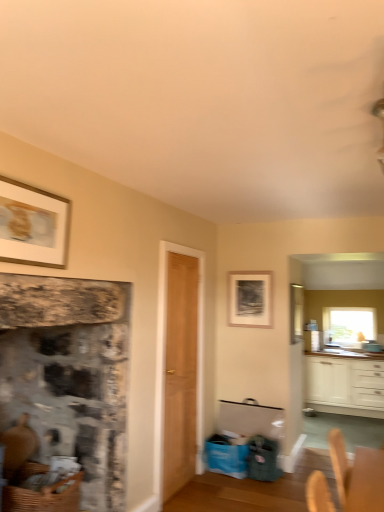
Find the location of a particular element. This screenshot has width=384, height=512. gold-framed picture at upper left, which ranks as the first picture frame in front-to-back order is located at coordinates (33, 225).

Image resolution: width=384 pixels, height=512 pixels. What are the coordinates of `rustic stone fireplace at left` in the screenshot? It's located at (69, 374).

What do you see at coordinates (43, 497) in the screenshot? This screenshot has height=512, width=384. I see `woven brown basket at lower left` at bounding box center [43, 497].

Locate an element on the screen. The image size is (384, 512). matte black picture frame at center, arranged as the first picture frame when ordered from the bottom is located at coordinates (250, 298).

The width and height of the screenshot is (384, 512). What do you see at coordinates (349, 325) in the screenshot?
I see `clear glass window at upper right` at bounding box center [349, 325].

The width and height of the screenshot is (384, 512). What are the coordinates of `clear glass window at upper right` in the screenshot? It's located at (349, 325).

What do you see at coordinates (344, 385) in the screenshot?
I see `white glossy cabinets at lower right` at bounding box center [344, 385].

You are a GUI agent. You are given a task and a screenshot of the screen. Output one action in this format:
    pyautogui.click(x=<x>, y=<y>)
    Task: Click on the gold-framed picture at upper left, which ranks as the second picture frame in bottom-to-top order
    
    Given the screenshot: What is the action you would take?
    pyautogui.click(x=33, y=225)

From the image's perspective, is matte black picture frame at center, arranged as the first picture frame when ordered from the bottom, beneath clear glass window screen at upper right?

Actually, matte black picture frame at center, arranged as the first picture frame when ordered from the bottom, appears above clear glass window screen at upper right in the image.

Is matte black picture frame at center, which is counted as the first picture frame, starting from the right, far away from clear glass window screen at upper right?

That's right, there is a large distance between matte black picture frame at center, which is counted as the first picture frame, starting from the right, and clear glass window screen at upper right.

Is matte black picture frame at center, arranged as the first picture frame when ordered from the bottom, closer to the viewer compared to clear glass window screen at upper right?

No, matte black picture frame at center, arranged as the first picture frame when ordered from the bottom, is further to the viewer.

Which is in front, point (295, 312) or point (53, 485)?

The point (53, 485) is closer to the camera.

Based on the photo, from a real-world perspective, is clear glass window screen at upper right positioned under woven brown basket at lower left based on gravity?

No, from a real-world perspective, clear glass window screen at upper right is not below woven brown basket at lower left.

Considering the positions of objects clear glass window screen at upper right and woven brown basket at lower left in the image provided, who is more to the left, clear glass window screen at upper right or woven brown basket at lower left?

woven brown basket at lower left is more to the left.

Considering the sizes of objects clear glass window screen at upper right and woven brown basket at lower left in the image provided, who is shorter, clear glass window screen at upper right or woven brown basket at lower left?

woven brown basket at lower left.

Would you say white glossy cabinets at lower right is inside or outside light brown wood door at center?

white glossy cabinets at lower right cannot be found inside light brown wood door at center.

Can you confirm if white glossy cabinets at lower right is shorter than light brown wood door at center?

Correct, white glossy cabinets at lower right is not as tall as light brown wood door at center.

Between white glossy cabinets at lower right and light brown wood door at center, which one has smaller width?

With smaller width is light brown wood door at center.

Is point (375, 410) closer or farther from the camera than point (183, 269)?

Point (375, 410).

Considering the relative positions of light brown wood door at center and clear glass window at upper right in the image provided, is light brown wood door at center to the right of clear glass window at upper right from the viewer's perspective?

No.

From the image's perspective, relative to clear glass window at upper right, is light brown wood door at center above or below?

light brown wood door at center is situated higher than clear glass window at upper right in the image.

Could you tell me if light brown wood door at center is facing clear glass window at upper right?

No, light brown wood door at center is not facing towards clear glass window at upper right.

Considering the points (191, 334) and (345, 307), which point is in front, point (191, 334) or point (345, 307)?

The point (191, 334) is in front.

Is the position of gold-framed picture at upper left, the 1th picture frame from the top, less distant than that of woven brown basket at lower left?

Yes, gold-framed picture at upper left, the 1th picture frame from the top, is closer to the viewer.

Which is closer, (65, 257) or (27, 492)?

Point (65, 257).

From a real-world perspective, is gold-framed picture at upper left, the 1th picture frame from the top, below woven brown basket at lower left?

No, from a real-world perspective, gold-framed picture at upper left, the 1th picture frame from the top, is not beneath woven brown basket at lower left.

Can you confirm if gold-framed picture at upper left, which ranks as the second picture frame in back-to-front order, is wider than woven brown basket at lower left?

No.

Can you confirm if gold-framed picture at upper left, the 1th picture frame from the top, is taller than clear glass window screen at upper right?

No.

Considering the relative sizes of gold-framed picture at upper left, which ranks as the first picture frame in front-to-back order, and clear glass window screen at upper right in the image provided, is gold-framed picture at upper left, which ranks as the first picture frame in front-to-back order, thinner than clear glass window screen at upper right?

Correct, the width of gold-framed picture at upper left, which ranks as the first picture frame in front-to-back order, is less than that of clear glass window screen at upper right.

From the image's perspective, who appears lower, gold-framed picture at upper left, the 2th picture frame positioned from the right, or clear glass window screen at upper right?

clear glass window screen at upper right is shown below in the image.

How much distance is there between gold-framed picture at upper left, which ranks as the second picture frame in bottom-to-top order, and clear glass window screen at upper right?

A distance of 13.55 feet exists between gold-framed picture at upper left, which ranks as the second picture frame in bottom-to-top order, and clear glass window screen at upper right.

Measure the distance from rustic stone fireplace at left to gold-framed picture at upper left, which ranks as the 1th picture frame in left-to-right order.

rustic stone fireplace at left and gold-framed picture at upper left, which ranks as the 1th picture frame in left-to-right order, are 24.62 inches apart.

From the image's perspective, which one is positioned lower, rustic stone fireplace at left or gold-framed picture at upper left, which ranks as the 1th picture frame in left-to-right order?

rustic stone fireplace at left, from the image's perspective.

Between rustic stone fireplace at left and gold-framed picture at upper left, the 1th picture frame from the top, which one appears on the right side from the viewer's perspective?

Positioned to the right is gold-framed picture at upper left, the 1th picture frame from the top.

What's the angular difference between rustic stone fireplace at left and gold-framed picture at upper left, which ranks as the second picture frame in back-to-front order,'s facing directions?

The angle between the facing direction of rustic stone fireplace at left and the facing direction of gold-framed picture at upper left, which ranks as the second picture frame in back-to-front order, is 1.1 degrees.

Where is `picture frame that is the 1st object located above the clear glass window screen at upper right (from the image's perspective)`? picture frame that is the 1st object located above the clear glass window screen at upper right (from the image's perspective) is located at coordinates (250, 298).

Where is `window screen above the woven brown basket at lower left (from a real-world perspective)`? window screen above the woven brown basket at lower left (from a real-world perspective) is located at coordinates (296, 312).

Which object lies nearer to the anchor point clear glass window at upper right, gold-framed picture at upper left, which ranks as the first picture frame in front-to-back order, or light brown wood door at center?

light brown wood door at center is closer to clear glass window at upper right.

Based on their spatial positions, is woven brown basket at lower left or clear glass window at upper right further from rustic stone fireplace at left?

Based on the image, clear glass window at upper right appears to be further to rustic stone fireplace at left.

Looking at the image, which one is located further to clear glass window at upper right, white glossy cabinets at lower right or clear glass window screen at upper right?

The object further to clear glass window at upper right is clear glass window screen at upper right.

Looking at the image, which one is located closer to woven brown basket at lower left, white glossy cabinets at lower right or clear glass window screen at upper right?

Based on the image, clear glass window screen at upper right appears to be nearer to woven brown basket at lower left.

Considering their positions, is light brown wood door at center positioned closer to white glossy cabinets at lower right than clear glass window screen at upper right?

clear glass window screen at upper right lies closer to white glossy cabinets at lower right than the other object.

Considering their positions, is matte black picture frame at center, acting as the second picture frame starting from the left, positioned closer to clear glass window screen at upper right than gold-framed picture at upper left, the 1th picture frame from the top?

Among the two, matte black picture frame at center, acting as the second picture frame starting from the left, is located nearer to clear glass window screen at upper right.

When comparing their distances from light brown wood door at center, does matte black picture frame at center, acting as the second picture frame starting from the left, or rustic stone fireplace at left seem further?

Based on the image, rustic stone fireplace at left appears to be further to light brown wood door at center.

Looking at the image, which one is located closer to gold-framed picture at upper left, which ranks as the first picture frame in front-to-back order, clear glass window at upper right or white glossy cabinets at lower right?

The object closer to gold-framed picture at upper left, which ranks as the first picture frame in front-to-back order, is clear glass window at upper right.

Find the location of a particular element. cabinetry positioned between matte black picture frame at center, acting as the second picture frame starting from the left, and clear glass window at upper right from near to far is located at coordinates (344, 385).

This screenshot has height=512, width=384. What are the coordinates of `picture frame between gold-framed picture at upper left, the 1th picture frame from the top, and white glossy cabinets at lower right, along the z-axis` in the screenshot? It's located at (250, 298).

The height and width of the screenshot is (512, 384). Find the location of `basket located between rustic stone fireplace at left and clear glass window at upper right in the depth direction`. basket located between rustic stone fireplace at left and clear glass window at upper right in the depth direction is located at coordinates (43, 497).

Locate an element on the screen. cabinetry located between clear glass window screen at upper right and clear glass window at upper right in the depth direction is located at coordinates (344, 385).